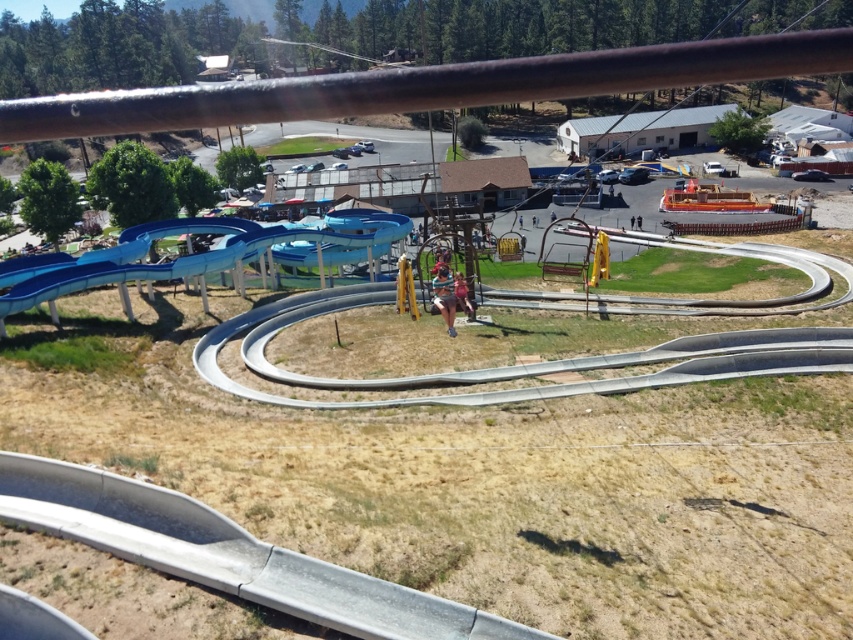
Looking at this image, you are a maintenance worker needing to inspect both the rusty metal rail at upper center and the blue smooth water slide at left. Which object should you check first if you want to start from the highest point in the scene?

You should check the rusty metal rail at upper center first because it is located above the blue smooth water slide at left, making it the higher of the two.

You are standing at the roller coaster vantage point looking down at the recreational area. There are two points marked on the ground below you. The first point is at coordinate (567, 96) and the second is at (56, 280). If you want to drop an object to the nearest point, which coordinate should you aim for?

The point at coordinate (567, 96) is closer to the viewer than point (56, 280), so you should aim for point (567, 96) to drop the object.

From the picture: You are a maintenance worker inspecting the area. You need to check the rusty metal rail at upper center and the blue smooth water slide at left. Which object is located to the left of the other?

The rusty metal rail at upper center is positioned on the left side of blue smooth water slide at left.